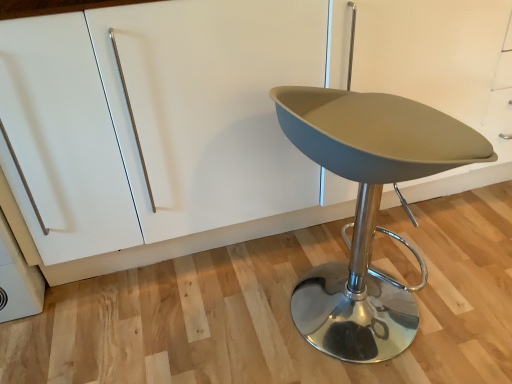
Image resolution: width=512 pixels, height=384 pixels. I want to click on free spot to the right of matte gray stool at center, so click(458, 291).